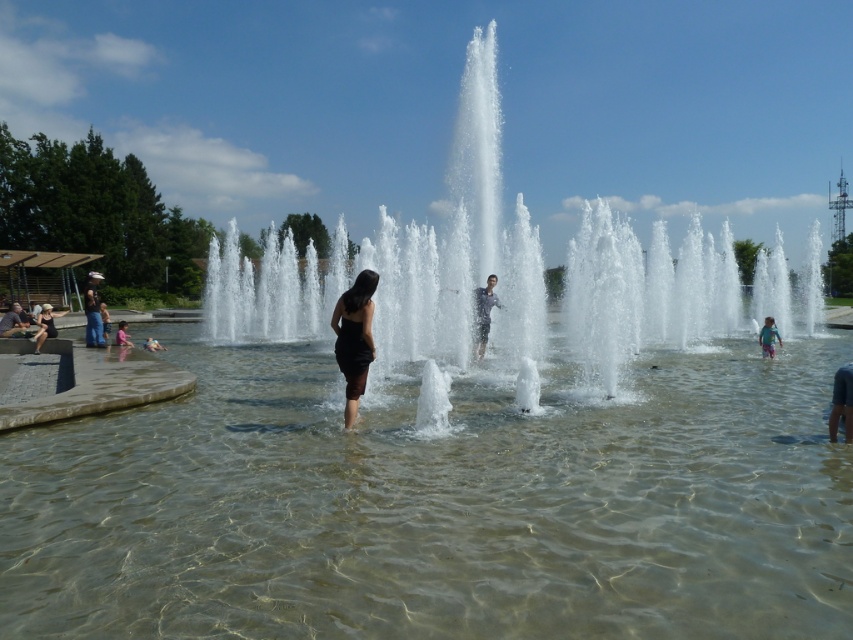
You are at the fountain and see the clear water at center and the clear water fountain at center. Which one is located to the left?

The clear water at center is positioned on the left side of the clear water fountain at center.